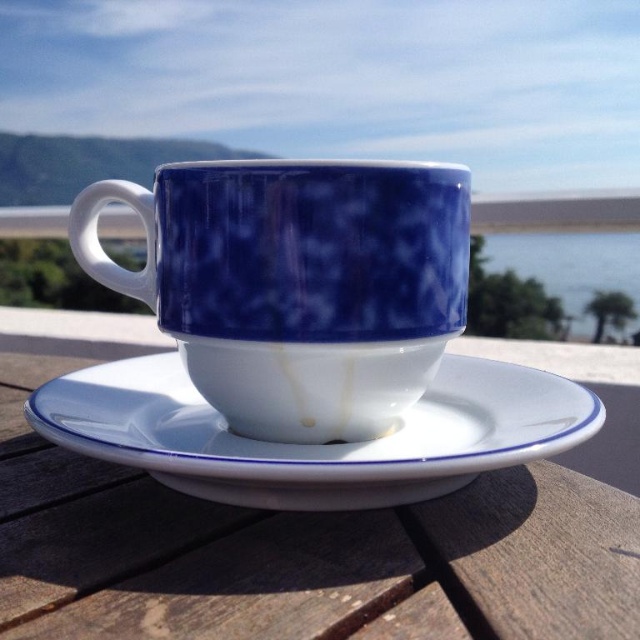
Between white wood table at center and blue glossy mug at center, which one appears on the right side from the viewer's perspective?

Positioned to the right is white wood table at center.

Between point (330, 586) and point (444, 188), which one is positioned behind?

Positioned behind is point (444, 188).

Between point (352, 525) and point (230, 234), which one is positioned behind?

Point (230, 234)

Where is `white wood table at center`? Image resolution: width=640 pixels, height=640 pixels. white wood table at center is located at coordinates (292, 548).

Does point (16, 627) come behind point (557, 268)?

No, it is not.

Does white wood table at center appear over blue glass water at upper right?

Incorrect, white wood table at center is not positioned above blue glass water at upper right.

Which is behind, point (310, 602) or point (630, 237)?

The point (630, 237) is more distant.

Locate an element on the screen. white wood table at center is located at coordinates (292, 548).

Between white wood table at center and white glossy saucer at center, which one has more height?

With more height is white wood table at center.

Does white wood table at center come in front of white glossy saucer at center?

Yes, it is.

Identify the location of white wood table at center. The height and width of the screenshot is (640, 640). (292, 548).